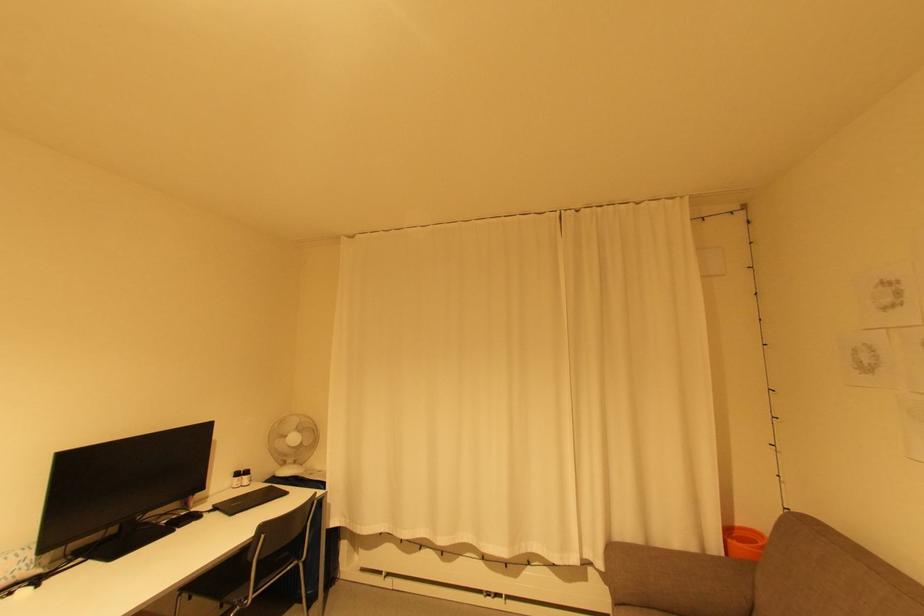
This screenshot has width=924, height=616. What do you see at coordinates (858, 582) in the screenshot?
I see `the sofa armrest` at bounding box center [858, 582].